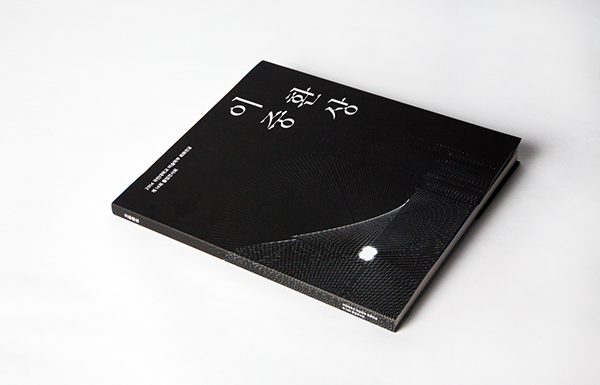
The height and width of the screenshot is (385, 600). I want to click on book, so click(347, 240).